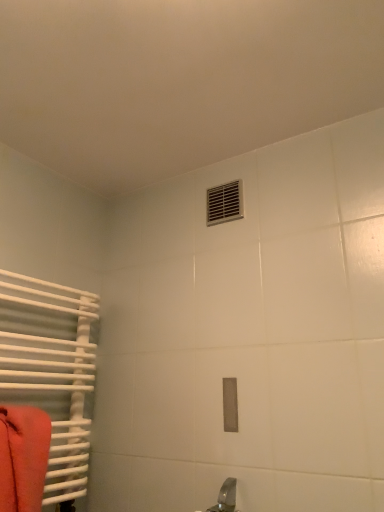
Question: Would you say white matte radiator at left is part of matte orange towel at left's contents?

Choices:
 (A) no
 (B) yes

Answer: (A)

Question: Does matte orange towel at left have a lesser height compared to white matte radiator at left?

Choices:
 (A) yes
 (B) no

Answer: (A)

Question: Is matte orange towel at left bigger than white matte radiator at left?

Choices:
 (A) no
 (B) yes

Answer: (A)

Question: Is matte orange towel at left outside of white matte radiator at left?

Choices:
 (A) yes
 (B) no

Answer: (B)

Question: From a real-world perspective, is matte orange towel at left located higher than white matte radiator at left?

Choices:
 (A) yes
 (B) no

Answer: (B)

Question: Would you consider matte orange towel at left to be distant from white matte radiator at left?

Choices:
 (A) no
 (B) yes

Answer: (A)

Question: Can you confirm if metallic silver vent at upper center is positioned to the right of white matte radiator at left?

Choices:
 (A) no
 (B) yes

Answer: (B)

Question: Considering the relative sizes of metallic silver vent at upper center and white matte radiator at left in the image provided, is metallic silver vent at upper center shorter than white matte radiator at left?

Choices:
 (A) yes
 (B) no

Answer: (A)

Question: From the image's perspective, is metallic silver vent at upper center on top of white matte radiator at left?

Choices:
 (A) no
 (B) yes

Answer: (B)

Question: Can you confirm if metallic silver vent at upper center is bigger than white matte radiator at left?

Choices:
 (A) no
 (B) yes

Answer: (A)

Question: Is metallic silver vent at upper center taller than white matte radiator at left?

Choices:
 (A) no
 (B) yes

Answer: (A)

Question: Is white matte radiator at left completely or partially inside metallic silver vent at upper center?

Choices:
 (A) yes
 (B) no

Answer: (B)

Question: Considering the relative sizes of metallic silver vent at upper center and matte orange towel at left in the image provided, is metallic silver vent at upper center bigger than matte orange towel at left?

Choices:
 (A) no
 (B) yes

Answer: (A)